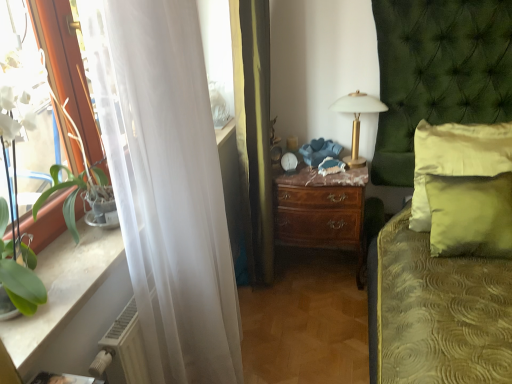
Locate an element on the screen. This screenshot has height=384, width=512. white sheer curtain at left is located at coordinates (166, 184).

Where is `green textured bed at center`? This screenshot has width=512, height=384. green textured bed at center is located at coordinates (438, 72).

What do you see at coordinates (122, 350) in the screenshot? I see `white plastic radiator at lower left` at bounding box center [122, 350].

In order to face gold metallic table lamp at upper center, should I rotate leftwards or rightwards?

You should rotate right by 13.481 degrees.

This screenshot has width=512, height=384. What do you see at coordinates (322, 211) in the screenshot?
I see `brown wood nightstand at center` at bounding box center [322, 211].

You are a GUI agent. You are given a task and a screenshot of the screen. Output one action in this format:
    pyautogui.click(x=<x>, y=<y>)
    Task: Click on the brown wood nightstand at center
    
    Given the screenshot: What is the action you would take?
    pyautogui.click(x=322, y=211)

I want to click on green satin pillow at right, the first pillow positioned from the back, so click(x=456, y=158).

From a real-world perspective, is green textured bed at center beneath brown wood nightstand at center?

Actually, green textured bed at center is physically above brown wood nightstand at center in the real world.

Which object is further away from the camera taking this photo, green textured bed at center or brown wood nightstand at center?

brown wood nightstand at center is further from the camera.

From the picture: Can you confirm if green textured bed at center is wider than brown wood nightstand at center?

Yes.

Which of these two, green textured bed at center or brown wood nightstand at center, is smaller?

brown wood nightstand at center is smaller.

Between green fabric pillow at right, positioned as the 2th pillow in back-to-front order, and green textured bed at center, which one has less height?

green fabric pillow at right, positioned as the 2th pillow in back-to-front order.

Considering the positions of objects green fabric pillow at right, marked as the 1th pillow in a front-to-back arrangement, and green textured bed at center in the image provided, who is more to the right, green fabric pillow at right, marked as the 1th pillow in a front-to-back arrangement, or green textured bed at center?

green fabric pillow at right, marked as the 1th pillow in a front-to-back arrangement, is more to the right.

Looking at this image, could you tell me if green fabric pillow at right, marked as the 1th pillow in a front-to-back arrangement, is turned towards green textured bed at center?

Yes, green fabric pillow at right, marked as the 1th pillow in a front-to-back arrangement, is aimed at green textured bed at center.

How different are the orientations of green fabric pillow at right, positioned as the 2th pillow in back-to-front order, and green textured bed at center in degrees?

The angular difference between green fabric pillow at right, positioned as the 2th pillow in back-to-front order, and green textured bed at center is 3.1 degrees.

Is white plastic radiator at lower left next to gold metallic table lamp at upper center?

No, white plastic radiator at lower left is not next to gold metallic table lamp at upper center.

Which is more to the right, white plastic radiator at lower left or gold metallic table lamp at upper center?

Positioned to the right is gold metallic table lamp at upper center.

How many degrees apart are the facing directions of white plastic radiator at lower left and gold metallic table lamp at upper center?

The angular difference between white plastic radiator at lower left and gold metallic table lamp at upper center is 91.3 degrees.

Which object is more forward, white plastic radiator at lower left or gold metallic table lamp at upper center?

white plastic radiator at lower left is closer to the camera.

Based on the photo, is white sheer curtain at left a part of green fabric pillow at right, positioned as the 2th pillow in back-to-front order?

That's incorrect, white sheer curtain at left is not inside green fabric pillow at right, positioned as the 2th pillow in back-to-front order.

Is green fabric pillow at right, positioned as the 2th pillow in back-to-front order, next to white sheer curtain at left?

No, green fabric pillow at right, positioned as the 2th pillow in back-to-front order, is not with white sheer curtain at left.

Is green fabric pillow at right, marked as the 1th pillow in a front-to-back arrangement, bigger than white sheer curtain at left?

Answer: No, green fabric pillow at right, marked as the 1th pillow in a front-to-back arrangement, is not bigger than white sheer curtain at left.

Is green fabric pillow at right, marked as the 1th pillow in a front-to-back arrangement, further to the viewer compared to white sheer curtain at left?

Yes, green fabric pillow at right, marked as the 1th pillow in a front-to-back arrangement, is behind white sheer curtain at left.

From the image's perspective, which object appears higher, white plastic radiator at lower left or white sheer curtain at left?

From the image's view, white sheer curtain at left is above.

Based on the photo, are white plastic radiator at lower left and white sheer curtain at left located far from each other?

white plastic radiator at lower left is actually quite close to white sheer curtain at left.

Is white plastic radiator at lower left oriented away from white sheer curtain at left?

Yes, white plastic radiator at lower left's orientation is away from white sheer curtain at left.

Locate an element on the screen. The image size is (512, 384). curtain above the white plastic radiator at lower left (from the image's perspective) is located at coordinates (166, 184).

Can you confirm if green satin pillow at right, acting as the second pillow starting from the front, is taller than brown wood nightstand at center?

Yes.

From the picture: Considering the sizes of green satin pillow at right, the first pillow positioned from the back, and brown wood nightstand at center in the image, is green satin pillow at right, the first pillow positioned from the back, bigger or smaller than brown wood nightstand at center?

Clearly, green satin pillow at right, the first pillow positioned from the back, is smaller in size than brown wood nightstand at center.

Is brown wood nightstand at center at the back of green satin pillow at right, the first pillow positioned from the back?

No.

Considering the relative sizes of green satin pillow at right, acting as the second pillow starting from the front, and brown wood nightstand at center in the image provided, is green satin pillow at right, acting as the second pillow starting from the front, wider than brown wood nightstand at center?

Incorrect, the width of green satin pillow at right, acting as the second pillow starting from the front, does not surpass that of brown wood nightstand at center.

Considering the relative sizes of white sheer curtain at left and green textured bed at center in the image provided, is white sheer curtain at left thinner than green textured bed at center?

Indeed, white sheer curtain at left has a lesser width compared to green textured bed at center.

Looking at this image, is white sheer curtain at left positioned far away from green textured bed at center?

Absolutely, white sheer curtain at left is distant from green textured bed at center.

Which object is closer to the camera taking this photo, white sheer curtain at left or green textured bed at center?

green textured bed at center is closer to the camera.

What are the coordinates of `nightstand below the green textured bed at center (from a real-world perspective)` in the screenshot? It's located at (322, 211).

At what (x,y) coordinates should I click in order to perform the action: click on bed that appears on the left of green fabric pillow at right, positioned as the 2th pillow in back-to-front order. Please return your answer as a coordinate pair (x, y). Image resolution: width=512 pixels, height=384 pixels. Looking at the image, I should click on (438, 72).

Considering their positions, is green satin pillow at right, the first pillow positioned from the back, positioned closer to white sheer curtain at left than white plastic radiator at lower left?

Among the two, white plastic radiator at lower left is located nearer to white sheer curtain at left.

Which object lies nearer to the anchor point green fabric pillow at right, marked as the 1th pillow in a front-to-back arrangement, white plastic radiator at lower left or gold metallic table lamp at upper center?

Based on the image, gold metallic table lamp at upper center appears to be nearer to green fabric pillow at right, marked as the 1th pillow in a front-to-back arrangement.

From the image, which object appears to be farther from white sheer curtain at left, green satin pillow at right, the first pillow positioned from the back, or brown wood nightstand at center?

green satin pillow at right, the first pillow positioned from the back.

Based on their spatial positions, is brown wood nightstand at center or green satin pillow at right, acting as the second pillow starting from the front, further from gold metallic table lamp at upper center?

green satin pillow at right, acting as the second pillow starting from the front, is further to gold metallic table lamp at upper center.

Considering their positions, is green fabric pillow at right, positioned as the 2th pillow in back-to-front order, positioned further to gold metallic table lamp at upper center than brown wood nightstand at center?

green fabric pillow at right, positioned as the 2th pillow in back-to-front order, is positioned further to the anchor gold metallic table lamp at upper center.

Looking at the image, which one is located closer to white sheer curtain at left, gold metallic table lamp at upper center or green fabric pillow at right, positioned as the 2th pillow in back-to-front order?

green fabric pillow at right, positioned as the 2th pillow in back-to-front order, lies closer to white sheer curtain at left than the other object.

Based on their spatial positions, is gold metallic table lamp at upper center or green satin pillow at right, the first pillow positioned from the back, closer to white plastic radiator at lower left?

Among the two, green satin pillow at right, the first pillow positioned from the back, is located nearer to white plastic radiator at lower left.

Based on their spatial positions, is green textured bed at center or white plastic radiator at lower left closer to brown wood nightstand at center?

green textured bed at center.

What are the coordinates of `pillow located between white sheer curtain at left and green satin pillow at right, the first pillow positioned from the back, in the left-right direction` in the screenshot? It's located at (470, 215).

Where is `radiator between green textured bed at center and brown wood nightstand at center along the z-axis`? radiator between green textured bed at center and brown wood nightstand at center along the z-axis is located at coordinates (122, 350).

Image resolution: width=512 pixels, height=384 pixels. Identify the location of curtain between green textured bed at center and white plastic radiator at lower left from front to back. (166, 184).

Locate an element on the screen. radiator between white sheer curtain at left and gold metallic table lamp at upper center in the front-back direction is located at coordinates (122, 350).